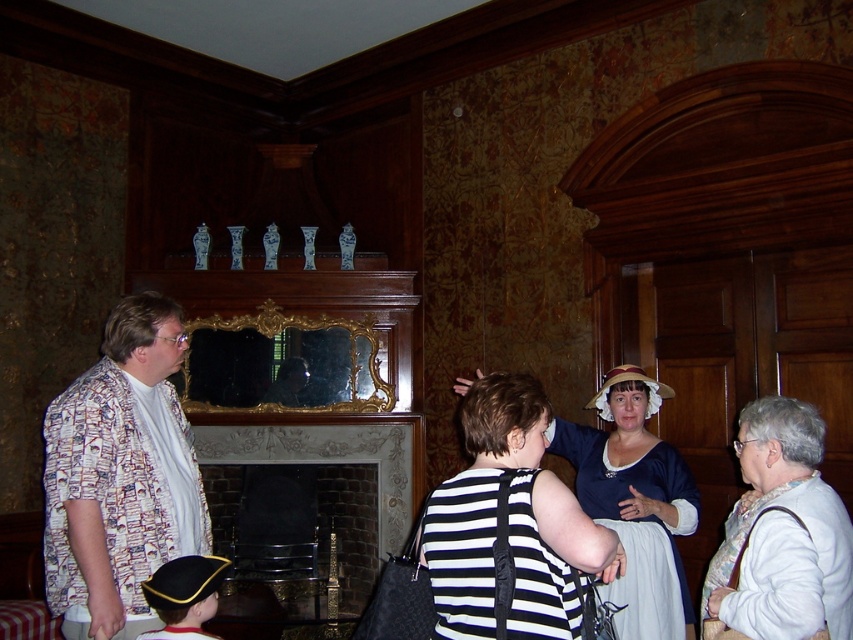
Question: Can you confirm if matte blue dress at center is smaller than brick fireplace at center?

Choices:
 (A) yes
 (B) no

Answer: (B)

Question: Which of the following is the farthest from the observer?

Choices:
 (A) white sweater at lower right
 (B) matte blue dress at center

Answer: (B)

Question: Does white sweater at lower right lie in front of brick fireplace at center?

Choices:
 (A) no
 (B) yes

Answer: (B)

Question: Among these points, which one is farthest from the camera?

Choices:
 (A) (392, 518)
 (B) (750, 500)

Answer: (A)

Question: Can you confirm if white sweater at lower right is bigger than matte blue dress at center?

Choices:
 (A) no
 (B) yes

Answer: (A)

Question: Which of the following is the farthest from the observer?

Choices:
 (A) matte blue dress at center
 (B) brick fireplace at center

Answer: (B)